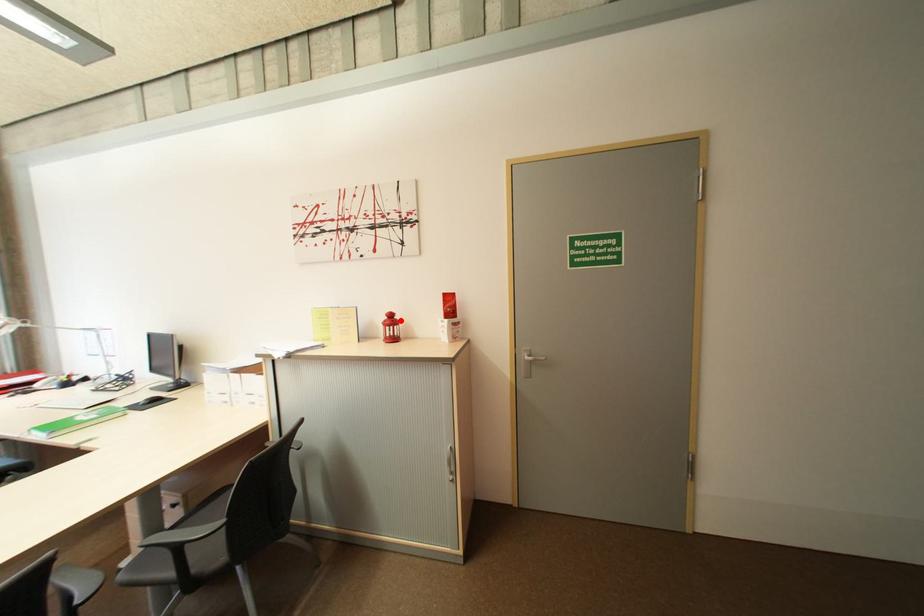
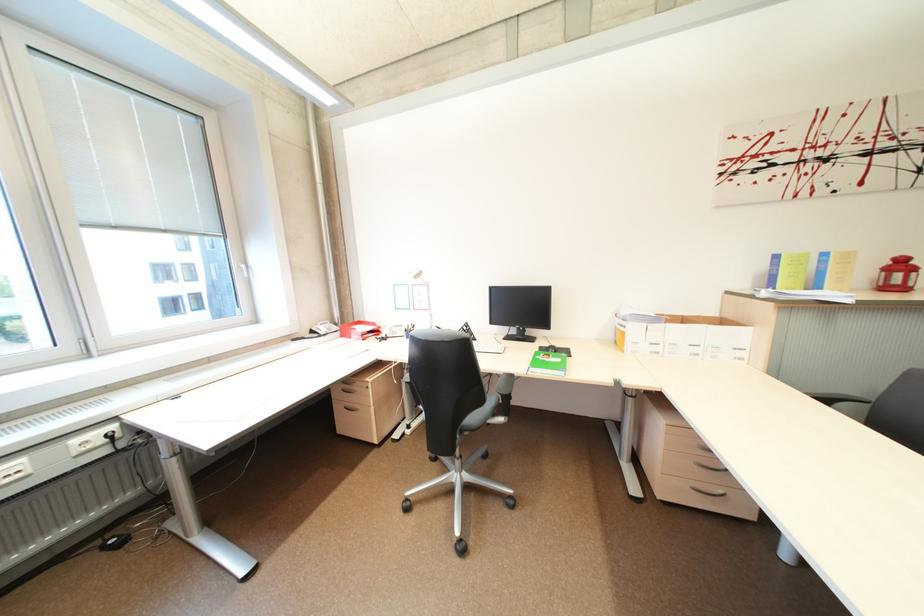
Question: I am providing you with two images of the same scene from different viewpoints. In image1, a red point is highlighted. Considering the same 3D point in image2, which of the following is correct?

Choices:
 (A) It is closer
 (B) It is farther

Answer: (B)